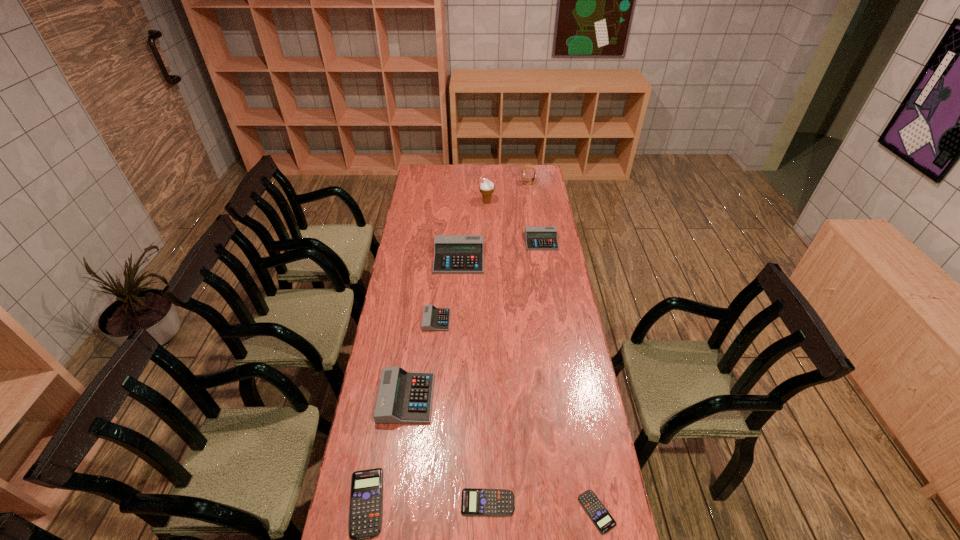
Locate an element on the screen. free space located 0.230m on the front of the third tallest object is located at coordinates (456, 311).

Locate an element on the screen. The width and height of the screenshot is (960, 540). free region located 0.320m on the right of the second biggest gray calculator is located at coordinates (523, 398).

The image size is (960, 540). Identify the location of vacant space positioned 0.130m on the back of the rightmost gray calculator. (538, 217).

Locate an element on the screen. Image resolution: width=960 pixels, height=540 pixels. vacant region located on the left of the smallest gray calculator is located at coordinates (389, 320).

Identify the location of free spot located 0.180m on the left of the second shortest object. (400, 502).

The height and width of the screenshot is (540, 960). Identify the location of vacant area located on the left of the smallest blue calculator. click(x=556, y=512).

Image resolution: width=960 pixels, height=540 pixels. Identify the location of object situated at the far edge. (525, 167).

You are a GUI agent. You are given a task and a screenshot of the screen. Output one action in this format:
    pyautogui.click(x=<x>, y=<y>)
    Task: Click on the watch present at the right edge
    
    Given the screenshot: What is the action you would take?
    pyautogui.click(x=525, y=167)

The image size is (960, 540). What are the coordinates of `object present at the far right corner` in the screenshot? It's located at (525, 167).

Where is `vacant space at the far edge of the desktop`? This screenshot has height=540, width=960. vacant space at the far edge of the desktop is located at coordinates (469, 183).